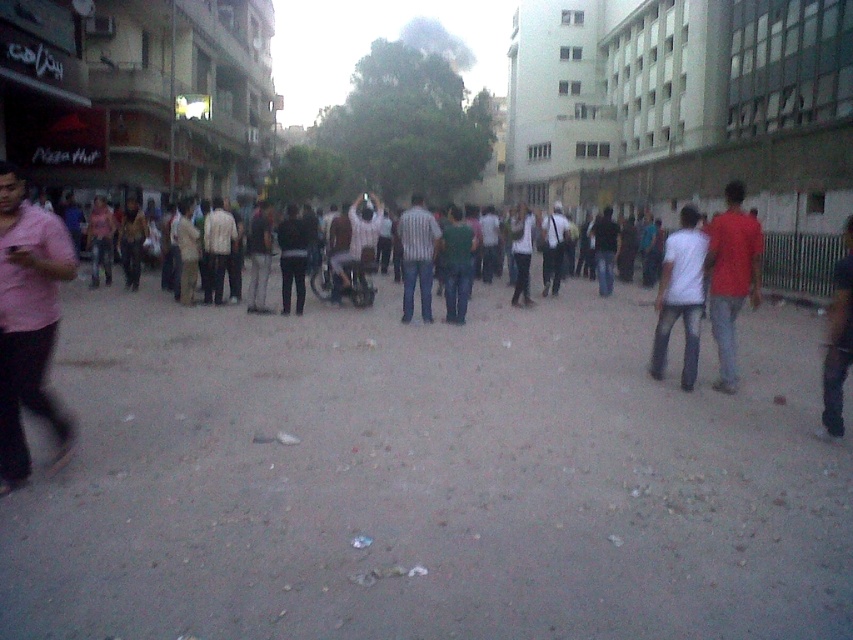
Does red matte shirt at right have a greater height compared to dark green shirt at center?

No.

Is red matte shirt at right shorter than dark green shirt at center?

Yes, red matte shirt at right is shorter than dark green shirt at center.

Does point (747, 248) come closer to viewer compared to point (563, 234)?

Yes, point (747, 248) is closer to viewer.

Locate an element on the screen. red matte shirt at right is located at coordinates (730, 276).

Who is lower down, white shirt at center or light brown shirt at center?

light brown shirt at center is lower down.

Is point (370, 294) behind point (216, 216)?

Yes, point (370, 294) is farther from viewer.

At what (x,y) coordinates should I click in order to perform the action: click on white shirt at center. Please return your answer as a coordinate pair (x, y). Looking at the image, I should click on (361, 248).

Can you confirm if striped fabric shirt at center is taller than dark blue jeans at center?

Correct, striped fabric shirt at center is much taller as dark blue jeans at center.

Which is behind, point (405, 289) or point (605, 228)?

The point (605, 228) is more distant.

Where is `striped fabric shirt at center`? The image size is (853, 640). striped fabric shirt at center is located at coordinates (416, 256).